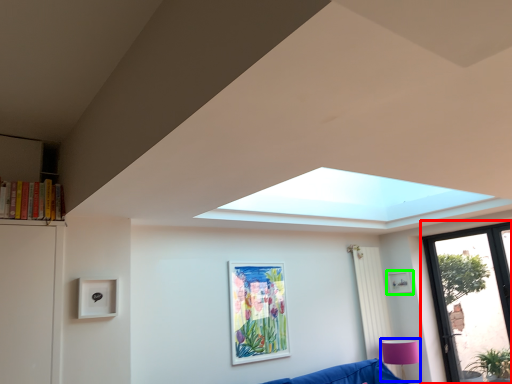
Question: Estimate the real-world distances between objects in this image. Which object is farther from window (highlighted by a red box), lamp (highlighted by a blue box) or picture frame (highlighted by a green box)?

Choices:
 (A) lamp
 (B) picture frame

Answer: (A)